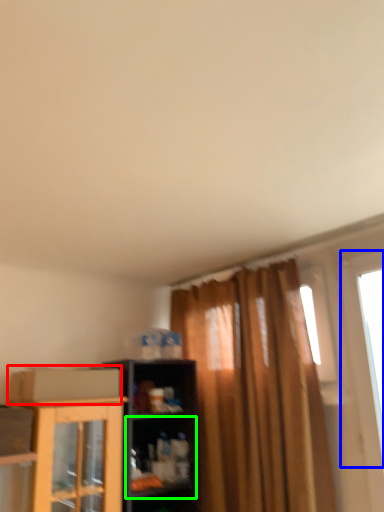
Question: Considering the real-world distances, which object is farthest from cardboard box (highlighted by a red box)? window (highlighted by a blue box) or shelf (highlighted by a green box)?

Choices:
 (A) window
 (B) shelf

Answer: (A)